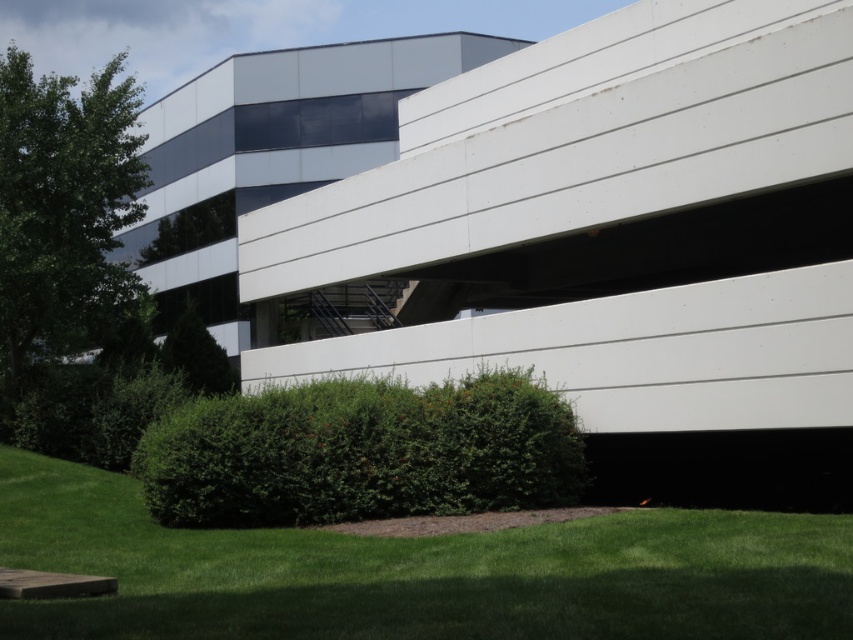
Question: In this image, where is green leafy bush at lower center located relative to green leafy tree at left?

Choices:
 (A) right
 (B) left

Answer: (A)

Question: Does green leafy bush at lower center appear under green leafy tree at left?

Choices:
 (A) yes
 (B) no

Answer: (A)

Question: Among these objects, which one is nearest to the camera?

Choices:
 (A) green leafy bush at lower center
 (B) green leafy tree at left

Answer: (A)

Question: Does green leafy bush at lower center appear under green leafy tree at left?

Choices:
 (A) no
 (B) yes

Answer: (B)

Question: Which point appears farthest from the camera in this image?

Choices:
 (A) [x=35, y=180]
 (B) [x=323, y=516]

Answer: (A)